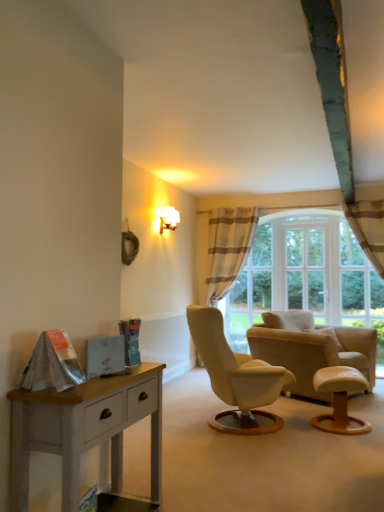
Locate an element on the screen. The image size is (384, 512). empty space that is ontop of white glass window at center (from a real-world perspective) is located at coordinates (303, 225).